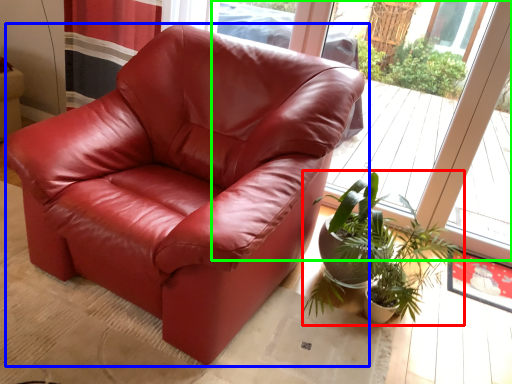
Question: Considering the real-world distances, which object is closest to houseplant (highlighted by a red box)? chair (highlighted by a blue box) or window (highlighted by a green box).

Choices:
 (A) chair
 (B) window

Answer: (A)